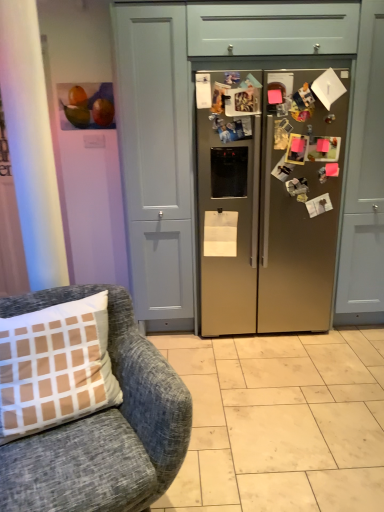
Where is `free spot in front of satin gold refrigerator at center`? free spot in front of satin gold refrigerator at center is located at coordinates (266, 415).